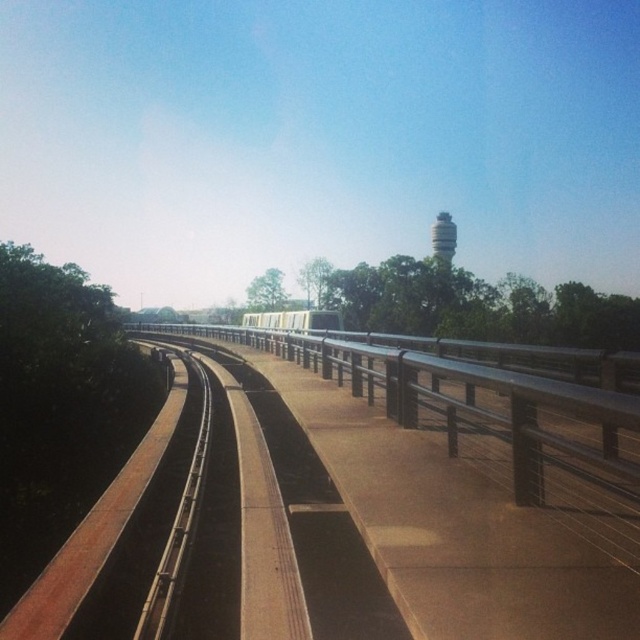
Which is behind, point (282, 316) or point (444, 225)?

The point (444, 225) is more distant.

Is point (292, 314) less distant than point (445, 236)?

That is True.

Where is `metallic silver train at center`? The image size is (640, 640). metallic silver train at center is located at coordinates (294, 320).